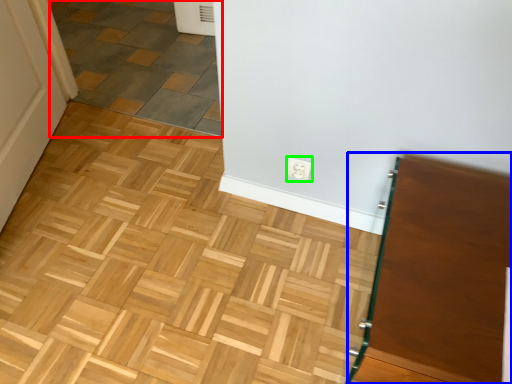
Question: Which object is the closest to the tile (highlighted by a red box)? Choose among these: vanity (highlighted by a blue box) or electric outlet (highlighted by a green box).

Choices:
 (A) vanity
 (B) electric outlet

Answer: (B)